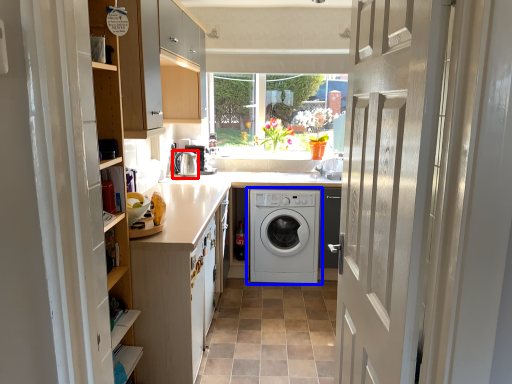
Question: Which object appears farthest to the camera in this image, water heater (highlighted by a red box) or washing machine (highlighted by a blue box)?

Choices:
 (A) water heater
 (B) washing machine

Answer: (A)